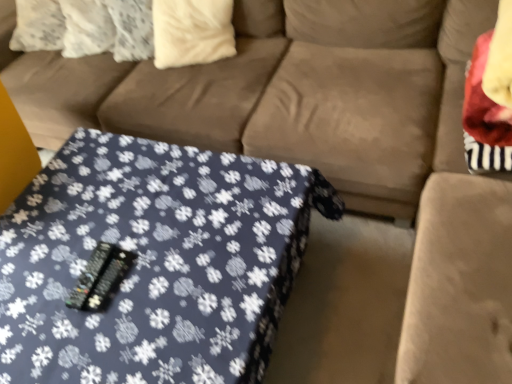
Question: Is white soft pillow at upper center at the left side of blue fabric table at center?

Choices:
 (A) yes
 (B) no

Answer: (B)

Question: Can you confirm if white soft pillow at upper center is shorter than blue fabric table at center?

Choices:
 (A) no
 (B) yes

Answer: (A)

Question: Is white soft pillow at upper center oriented towards blue fabric table at center?

Choices:
 (A) yes
 (B) no

Answer: (A)

Question: From a real-world perspective, is white soft pillow at upper center positioned over blue fabric table at center based on gravity?

Choices:
 (A) no
 (B) yes

Answer: (B)

Question: Is white soft pillow at upper center not inside blue fabric table at center?

Choices:
 (A) yes
 (B) no

Answer: (A)

Question: Can you confirm if white soft pillow at upper center is bigger than blue fabric table at center?

Choices:
 (A) no
 (B) yes

Answer: (A)

Question: From the image's perspective, is blue fabric table at center below white soft pillow at upper center?

Choices:
 (A) yes
 (B) no

Answer: (A)

Question: Can you confirm if blue fabric table at center is positioned to the left of white soft pillow at upper center?

Choices:
 (A) no
 (B) yes

Answer: (B)

Question: From a real-world perspective, is blue fabric table at center on top of white soft pillow at upper center?

Choices:
 (A) yes
 (B) no

Answer: (B)

Question: Is blue fabric table at center smaller than white soft pillow at upper center?

Choices:
 (A) yes
 (B) no

Answer: (B)

Question: Is blue fabric table at center taller than white soft pillow at upper center?

Choices:
 (A) no
 (B) yes

Answer: (A)

Question: From the image's perspective, would you say blue fabric table at center is positioned over white soft pillow at upper center?

Choices:
 (A) yes
 (B) no

Answer: (B)

Question: Which is correct: blue fabric table at center is inside white soft pillow at upper center, or outside of it?

Choices:
 (A) outside
 (B) inside

Answer: (A)